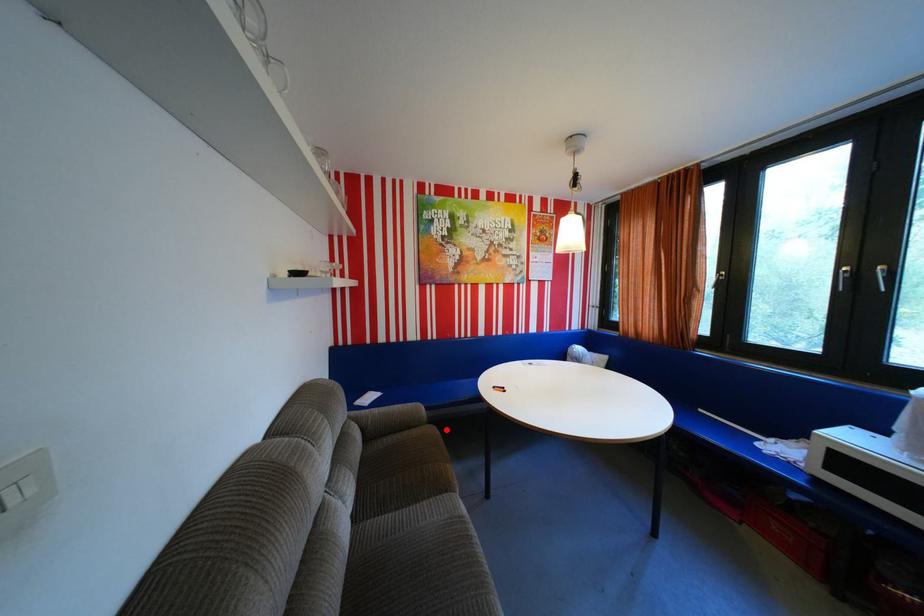
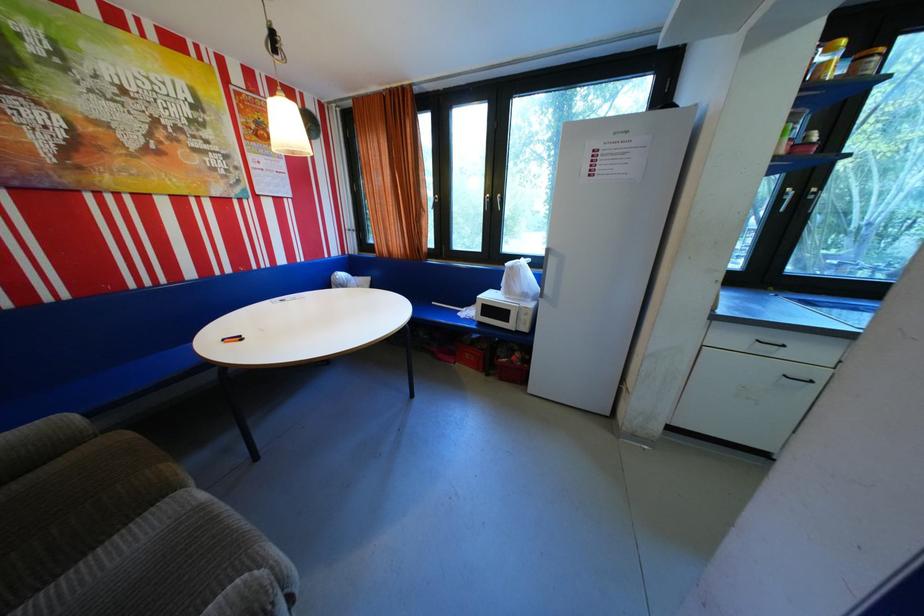
Question: I am providing you with two images of the same scene from different viewpoints. In image1, a red point is highlighted. Considering the same 3D point in image2, which of the following is correct?

Choices:
 (A) It is closer
 (B) It is farther

Answer: (A)